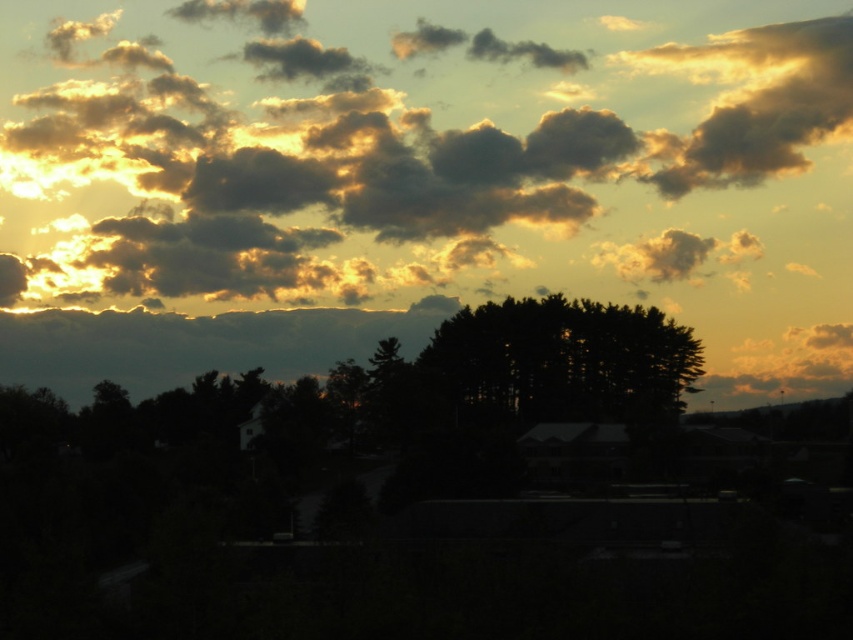
Who is positioned more to the left, golden fluffy cloud at upper center or black matte tree at center?

golden fluffy cloud at upper center is more to the left.

Can you confirm if golden fluffy cloud at upper center is shorter than black matte tree at center?

No.

Who is more distant from viewer, (173,154) or (552,298)?

The point (173,154) is behind.

The height and width of the screenshot is (640, 853). I want to click on golden fluffy cloud at upper center, so click(393, 140).